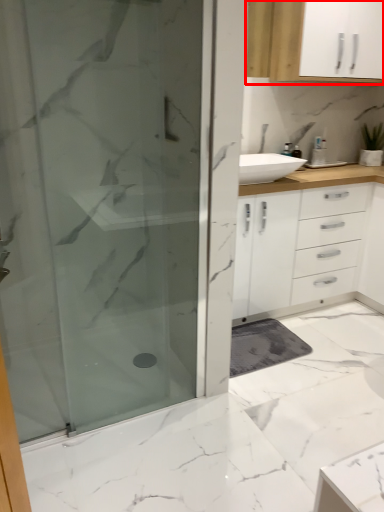
Question: Where is cabinetry (annotated by the red box) located in relation to shower door in the image?

Choices:
 (A) right
 (B) left

Answer: (A)